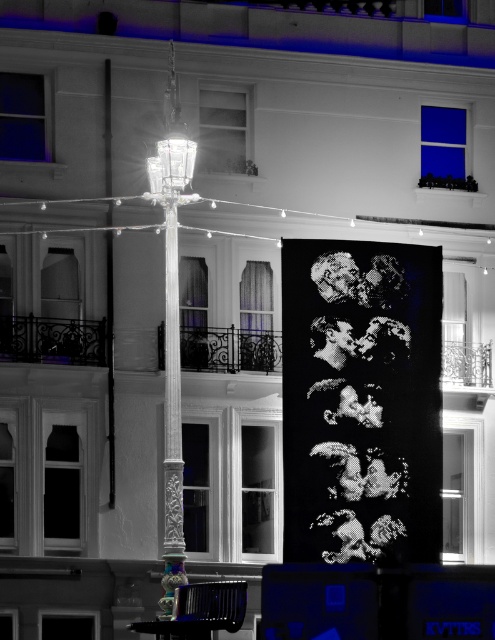
You are standing in the middle of a dark street and see the white glossy lamp post at center and the silver metallic pole at center. Which object is closer to your left side?

The white glossy lamp post at center is positioned on the left side of the silver metallic pole at center, so it is closer to your left side.

You are a city planner assessing the central plaza. You need to install a new streetlight that must be at least 3 meters tall. Given the white glossy lamp post at center and the silver metallic pole at center, which one can fulfill this requirement?

The white glossy lamp post at center is much taller than the silver metallic pole at center, so it can fulfill the requirement of being at least 3 meters tall.

You are a photographer standing in the middle of the street looking at the white glossy lamp post at center and the silver metallic pole at center. Which object is closer to you?

The white glossy lamp post at center is closer to you because it is in front of the silver metallic pole at center.